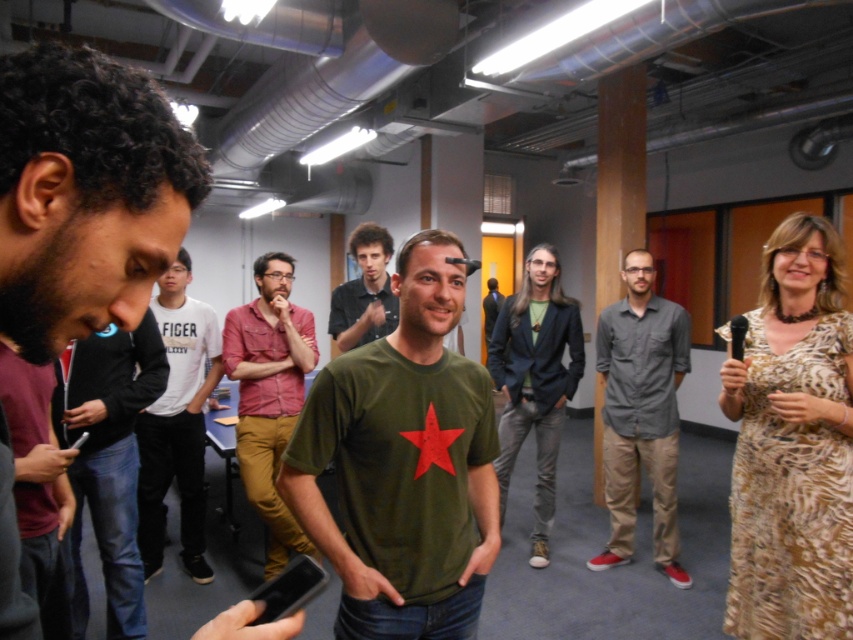
Is green matte t-shirt at center wider than dark green t-shirt at center?

No.

Is point (461, 497) positioned in front of point (44, 416)?

Yes, it is.

Locate an element on the screen. The width and height of the screenshot is (853, 640). green matte t-shirt at center is located at coordinates (403, 464).

Is point (77, 579) farther from viewer compared to point (538, 438)?

No, (77, 579) is in front of (538, 438).

Is black matte jacket at left further to the viewer compared to patterned fabric dress at center?

No, it is in front of patterned fabric dress at center.

Does point (151, 403) lie behind point (544, 404)?

No, it is in front of (544, 404).

Find the location of a particular element. This screenshot has width=853, height=640. black matte jacket at left is located at coordinates (108, 460).

Is black matte jacket at left further to the viewer compared to gray cotton shirt at center?

No.

Which is more to the left, black matte jacket at left or gray cotton shirt at center?

black matte jacket at left is more to the left.

Which is behind, point (128, 413) or point (683, 588)?

Positioned behind is point (683, 588).

In order to click on black matte jacket at left in this screenshot , I will do `click(108, 460)`.